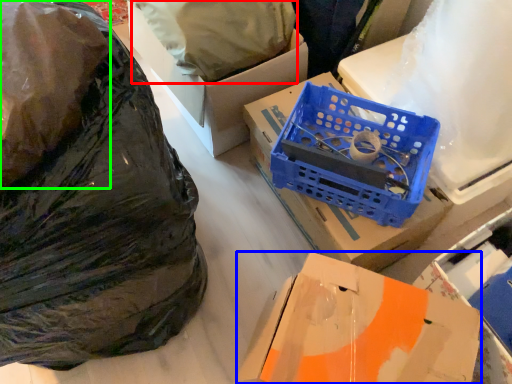
Question: Which object is positioned farthest from wrapping paper (highlighted by a red box)? Select from box (highlighted by a blue box) and plastic bag (highlighted by a green box).

Choices:
 (A) box
 (B) plastic bag

Answer: (A)